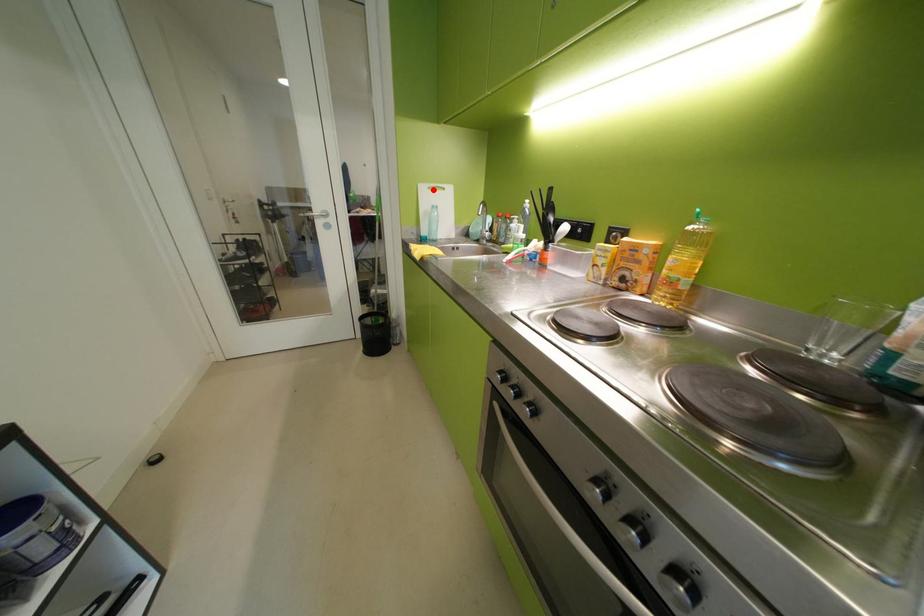
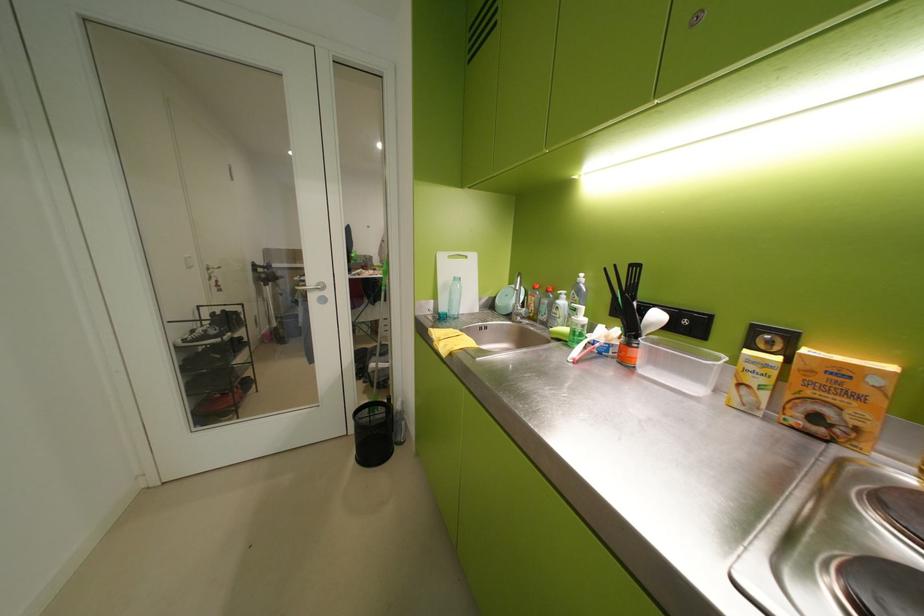
Question: I am providing you with two images of the same scene from different viewpoints. Image1 has a red point marked. In image2, the corresponding 3D location appears at what relative position? Reply with the corresponding letter.

Choices:
 (A) Closer
 (B) Farther

Answer: (B)